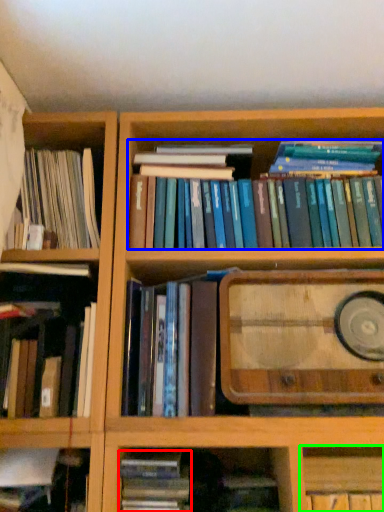
Question: Estimate the real-world distances between objects in this image. Which object is closer to book (highlighted by a red box), book (highlighted by a blue box) or cabinet (highlighted by a green box)?

Choices:
 (A) book
 (B) cabinet

Answer: (B)